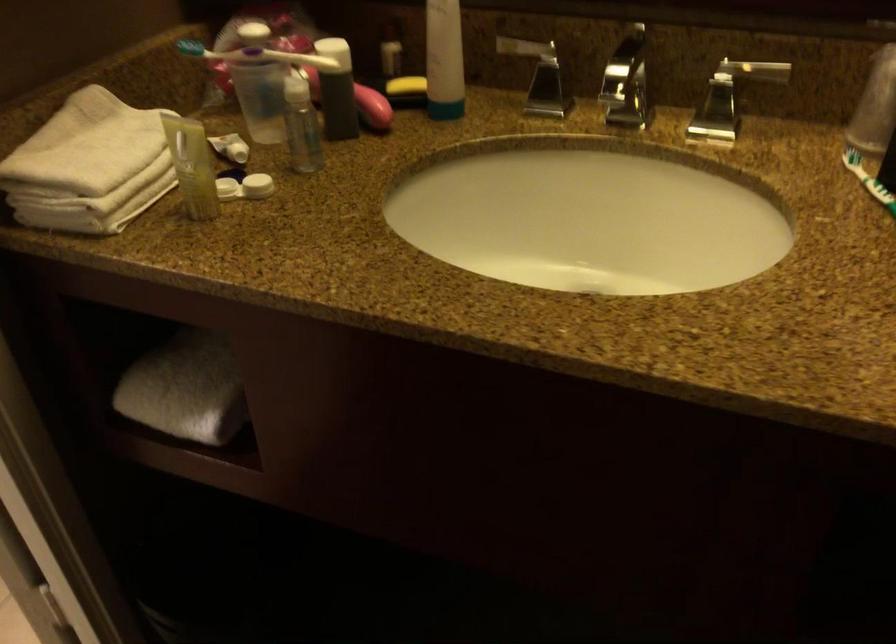
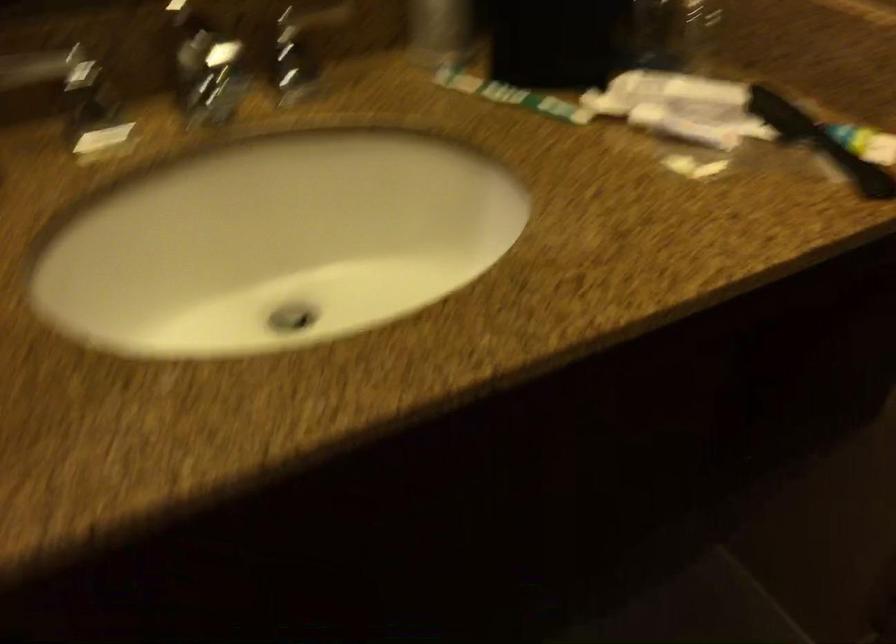
Question: Based on the continuous images, in which direction is the camera rotating? Reply with the corresponding letter.

Choices:
 (A) Left
 (B) Right
 (C) Up
 (D) Down

Answer: (B)